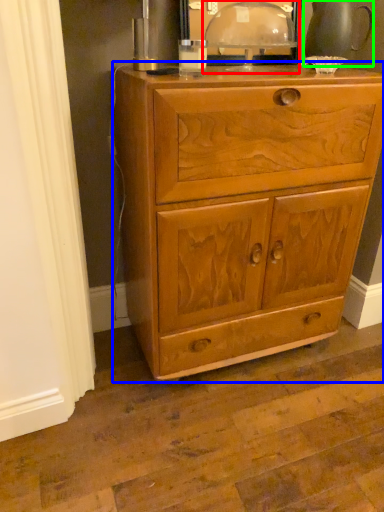
Question: Based on their relative distances, which object is nearer to table lamp (highlighted by a red box)? Choose from chest of drawers (highlighted by a blue box) and tea pot (highlighted by a green box).

Choices:
 (A) chest of drawers
 (B) tea pot

Answer: (B)